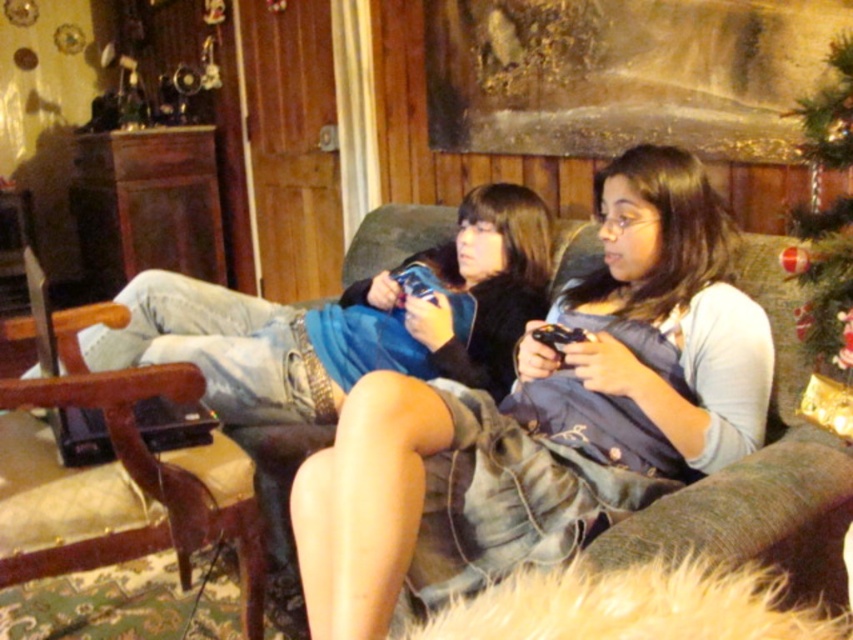
Who is positioned more to the right, denim shorts at center or green fabric christmas tree at upper right?

Positioned to the right is green fabric christmas tree at upper right.

Is denim shorts at center positioned before green fabric christmas tree at upper right?

That is True.

Does point (387, 564) come behind point (809, 332)?

No, it is not.

Where is `denim shorts at center`? denim shorts at center is located at coordinates (544, 417).